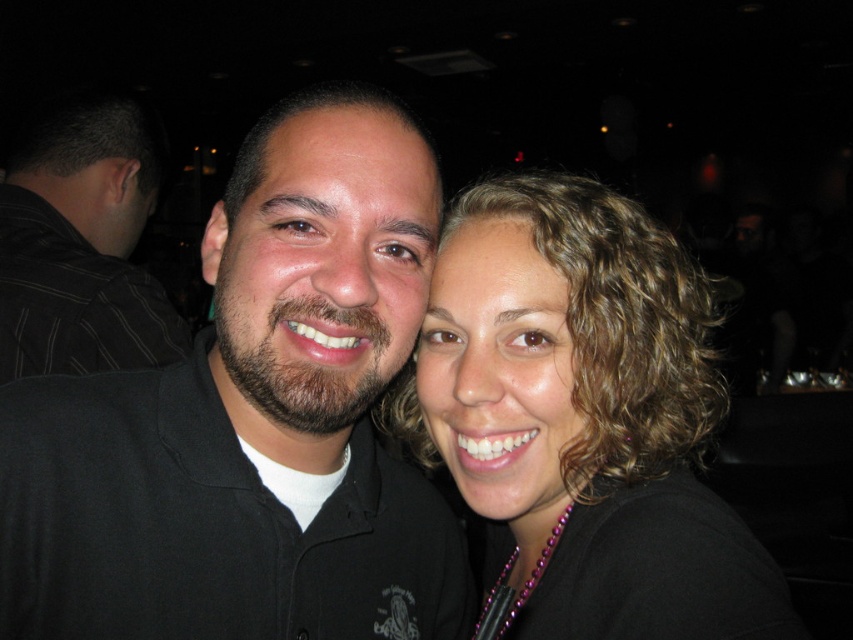
Question: Can you confirm if curly hair at center is positioned to the right of black striped shirt at left?

Choices:
 (A) yes
 (B) no

Answer: (A)

Question: Does curly hair at center have a larger size compared to black striped shirt at left?

Choices:
 (A) no
 (B) yes

Answer: (B)

Question: Which point is farther to the camera?

Choices:
 (A) (572, 618)
 (B) (71, 284)

Answer: (B)

Question: Can you confirm if curly hair at center is bigger than black striped shirt at left?

Choices:
 (A) yes
 (B) no

Answer: (A)